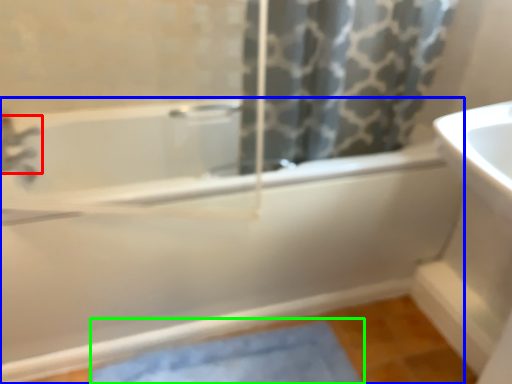
Question: Estimate the real-world distances between objects in this image. Which object is closer to tap (highlighted by a red box), bathtub (highlighted by a blue box) or bath mat (highlighted by a green box)?

Choices:
 (A) bathtub
 (B) bath mat

Answer: (A)